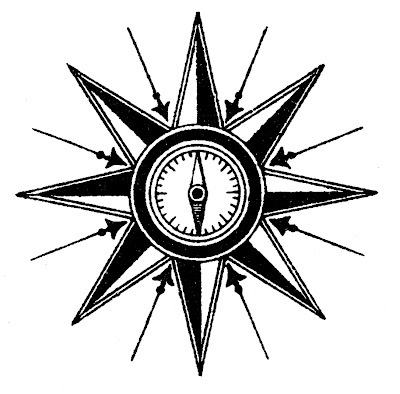
Image resolution: width=400 pixels, height=394 pixels. Find the location of `white clock hand`. white clock hand is located at coordinates (196, 175).